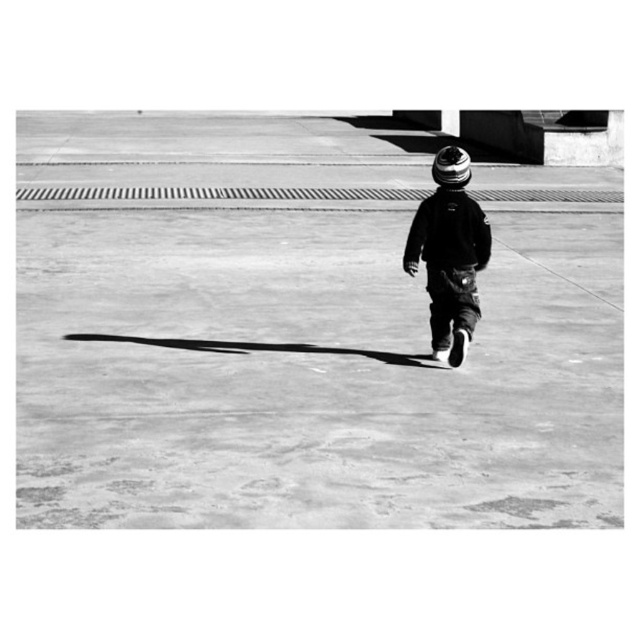
Looking at this image, based on the scene description, where is the smooth concrete pavement at center located in terms of its 2D coordinates?

The smooth concrete pavement at center is located at the 2D coordinates of point (x=301, y=332).

You are a photographer analyzing the composition of this black and white photo. The image has a point at coordinates (449, 253). Which object in the scene does this point correspond to?

The point at coordinates (449, 253) corresponds to the striped knit hat at center.